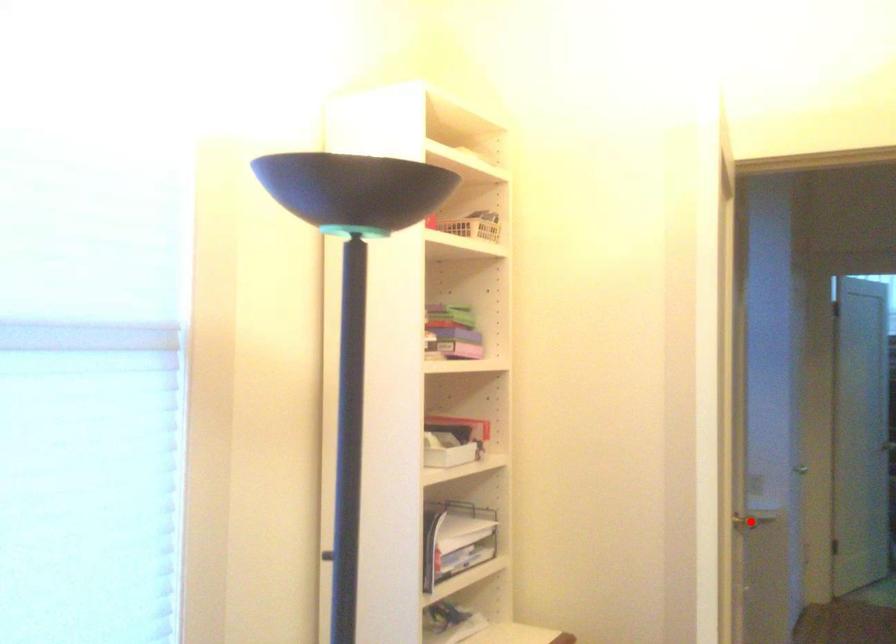
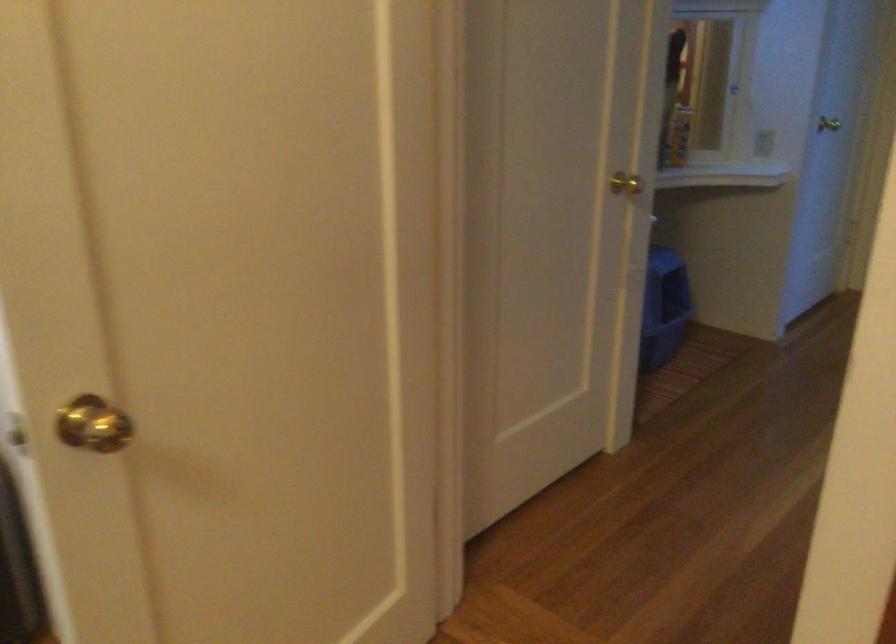
Question: I am providing you with two images of the same scene from different viewpoints. Given a red point in image1, look at the same physical point in image2. Is it:

Choices:
 (A) Closer to the viewpoint
 (B) Farther from the viewpoint

Answer: (A)